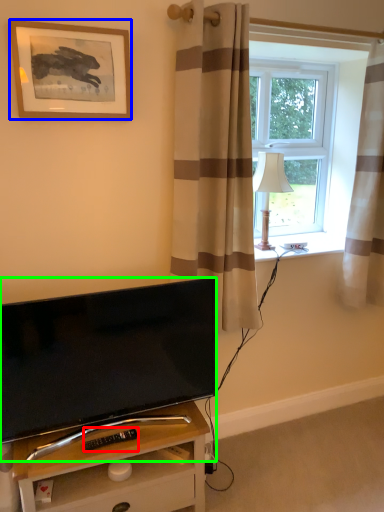
Question: Which is farther away from remote control (highlighted by a red box)? picture frame (highlighted by a blue box) or television (highlighted by a green box)?

Choices:
 (A) picture frame
 (B) television

Answer: (A)